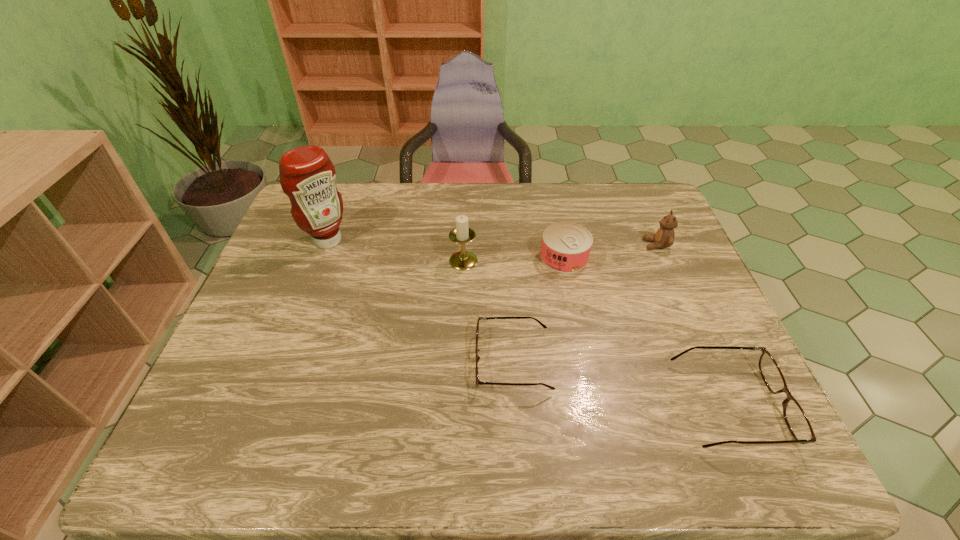
Find the location of a particular element. free space that is in between the condiment and the shortest object is located at coordinates (420, 301).

The width and height of the screenshot is (960, 540). Find the location of `empty location between the tallest object and the shortest object`. empty location between the tallest object and the shortest object is located at coordinates (420, 301).

Identify the location of blank region between the tallest object and the teddy bear. Image resolution: width=960 pixels, height=540 pixels. (492, 242).

Where is `vacant space in between the third shortest object and the shortest object`? vacant space in between the third shortest object and the shortest object is located at coordinates (539, 309).

Identify the location of free space between the third object from right to left and the fourth shortest object. This screenshot has height=540, width=960. (611, 251).

Image resolution: width=960 pixels, height=540 pixels. In order to click on free space between the fourth object from left to right and the third tallest object in this screenshot , I will do `click(611, 251)`.

Locate an element on the screen. vacant point located between the can and the left spectacles is located at coordinates (539, 309).

At what (x,y) coordinates should I click in order to perform the action: click on object that is the nearest to the shortest object. Please return your answer as a coordinate pair (x, y). The width and height of the screenshot is (960, 540). Looking at the image, I should click on (566, 246).

Locate an element on the screen. This screenshot has width=960, height=540. object identified as the second closest to the second tallest object is located at coordinates (478, 382).

Identify the location of free location that satisfies the following two spatial constraints: 1. on the front-facing side of the fourth shortest object; 2. on the front side of the can. The image size is (960, 540). (662, 257).